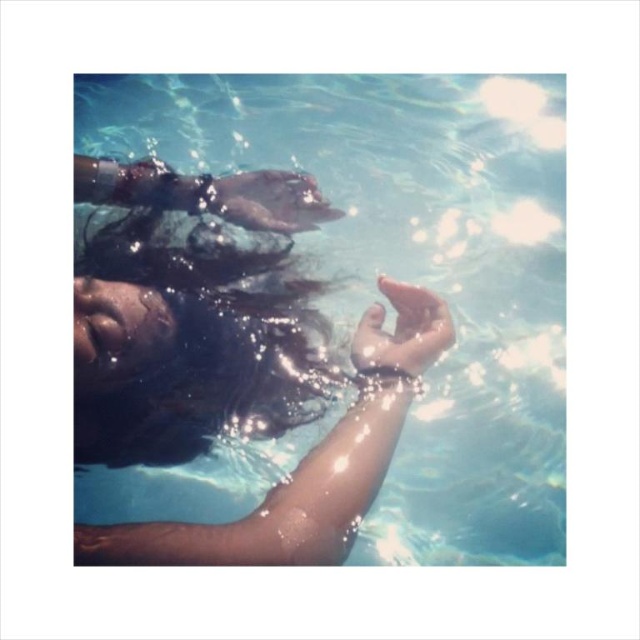
Question: Can you confirm if clear water at center is positioned to the left of wet dark brown hair at center?

Choices:
 (A) no
 (B) yes

Answer: (A)

Question: Which of the following is the farthest from the observer?

Choices:
 (A) (275, 128)
 (B) (296, 348)
 (C) (275, 189)
 (D) (396, 364)

Answer: (A)

Question: Is clear water at center positioned at the back of translucent wet skin at center?

Choices:
 (A) yes
 (B) no

Answer: (A)

Question: Which object appears closest to the camera in this image?

Choices:
 (A) clear water at center
 (B) smooth skin hand at center

Answer: (A)

Question: Which object is closer to the camera taking this photo?

Choices:
 (A) wet dark brown hair at center
 (B) translucent wet skin at center

Answer: (B)

Question: Does clear water at center appear on the left side of translucent wet skin at center?

Choices:
 (A) yes
 (B) no

Answer: (A)